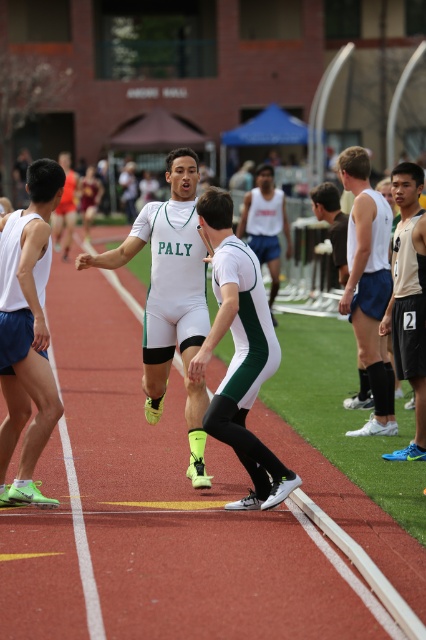
Which is below, matte white shorts at right or tan jersey at right?

tan jersey at right

Identify the location of matte white shorts at right. (368, 284).

Where is `matte white shorts at right`? matte white shorts at right is located at coordinates [x=368, y=284].

Is point (259, 380) positioned before point (290, 248)?

Yes.

Is white matte athletic uniform at center below white tank top at center?

Correct, white matte athletic uniform at center is located below white tank top at center.

I want to click on white matte athletic uniform at center, so click(x=239, y=353).

This screenshot has height=640, width=426. Find the location of `white matte athletic uniform at center`. white matte athletic uniform at center is located at coordinates (239, 353).

Is matte white shorts at right wider than white tank top at center?

Incorrect, matte white shorts at right's width does not surpass white tank top at center's.

Who is shorter, matte white shorts at right or white tank top at center?

Standing shorter between the two is matte white shorts at right.

Does point (368, 324) come farther from viewer compared to point (273, 272)?

No, (368, 324) is in front of (273, 272).

The image size is (426, 640). I want to click on matte white shorts at right, so click(x=368, y=284).